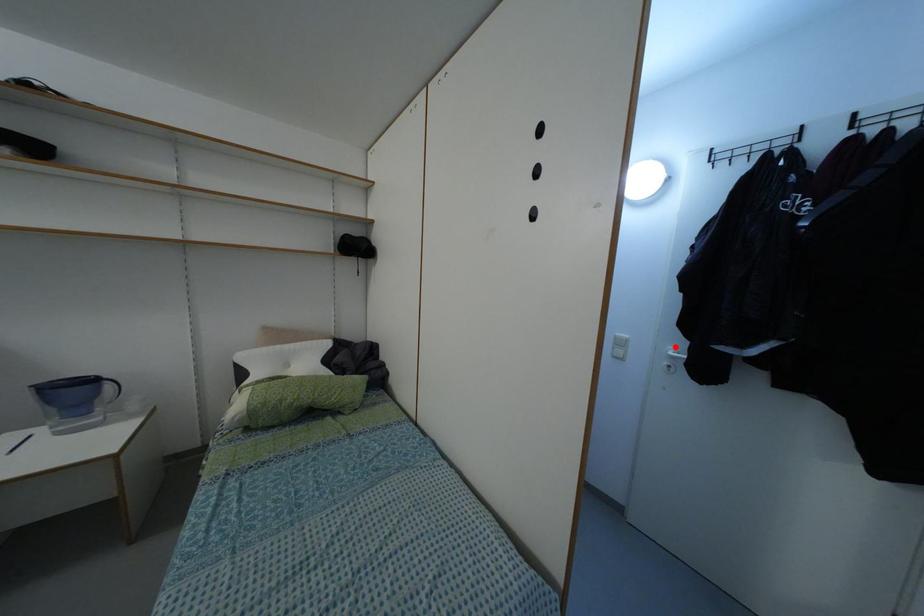
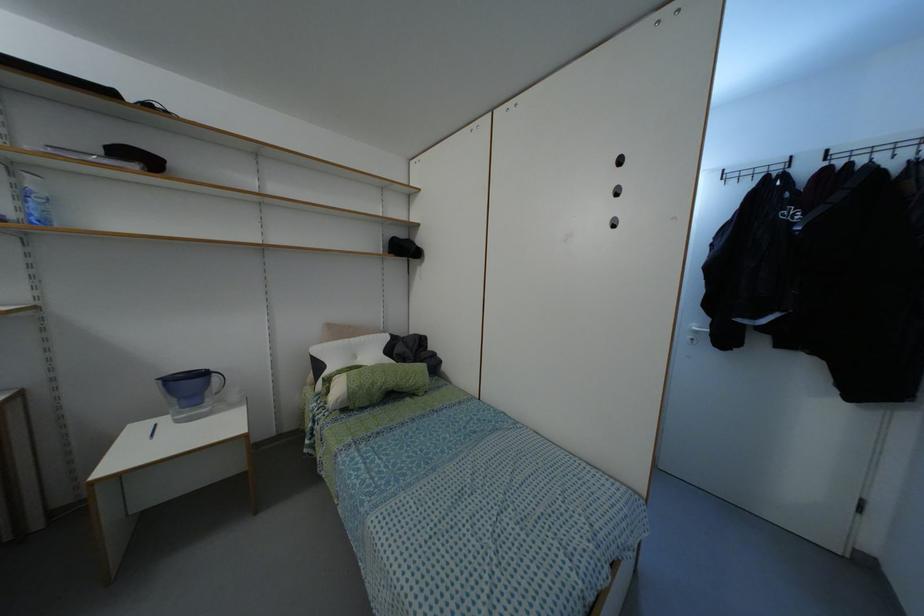
Where in the second image is the point corresponding to the highlighted location from the first image?

(698, 323)